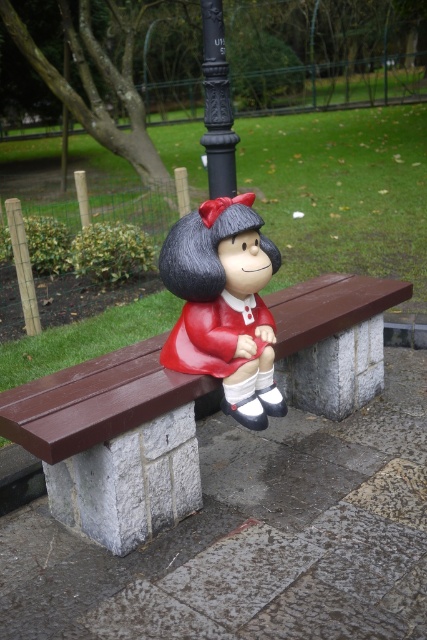
You are a visitor in the park and want to sit on the brown wooden bench at center. To your right, you see the black cast iron pole at upper center. Where is the bench located relative to the pole?

The brown wooden bench at center is to the left of the black cast iron pole at upper center.

You are a visitor in the park and want to take a photo of the brown wooden bench at center and the matte red plastic figurine at center. If you stand in front of the bench, will the figurine be partially hidden behind the bench in your photo?

The brown wooden bench at center is in front of the matte red plastic figurine at center, so if you stand in front of the bench, the figurine will be partially hidden behind the bench in your photo.